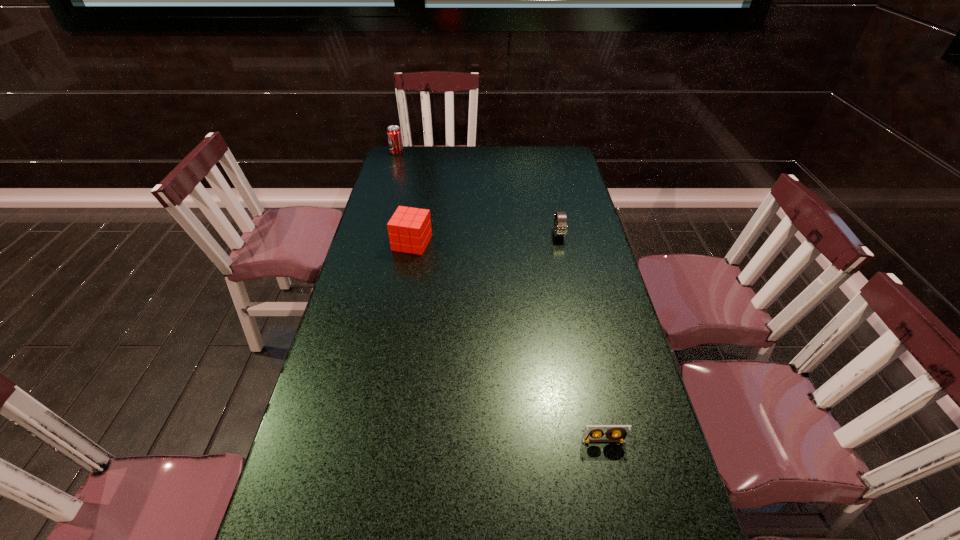
This screenshot has width=960, height=540. Identify the location of the farthest object. (394, 135).

Find the location of a particular element. This screenshot has width=960, height=540. the leftmost object is located at coordinates [394, 135].

You are a GUI agent. You are given a task and a screenshot of the screen. Output one action in this format:
    pyautogui.click(x=<x>, y=<y>)
    Task: Click on the third object from right to left
    The width and height of the screenshot is (960, 540).
    Given the screenshot: What is the action you would take?
    pyautogui.click(x=409, y=229)

Where is `the third tallest object`? the third tallest object is located at coordinates pyautogui.click(x=560, y=229).

Locate an element on the screen. The height and width of the screenshot is (540, 960). videotape is located at coordinates (616, 433).

Locate an element on the screen. the nearest object is located at coordinates (616, 433).

Image resolution: width=960 pixels, height=540 pixels. I want to click on free space located on the right of the soda, so click(x=458, y=152).

I want to click on vacant space located on the front of the cube, so click(393, 355).

Identify the location of vacant region located on the face of the watch. (572, 298).

You are a GUI agent. You are given a task and a screenshot of the screen. Output one action in this format:
    pyautogui.click(x=<x>, y=<y>)
    Task: Click on the vacant point located 0.100m at the front of the videotape with visible reels
    This screenshot has width=960, height=540.
    Given the screenshot: What is the action you would take?
    pyautogui.click(x=614, y=490)